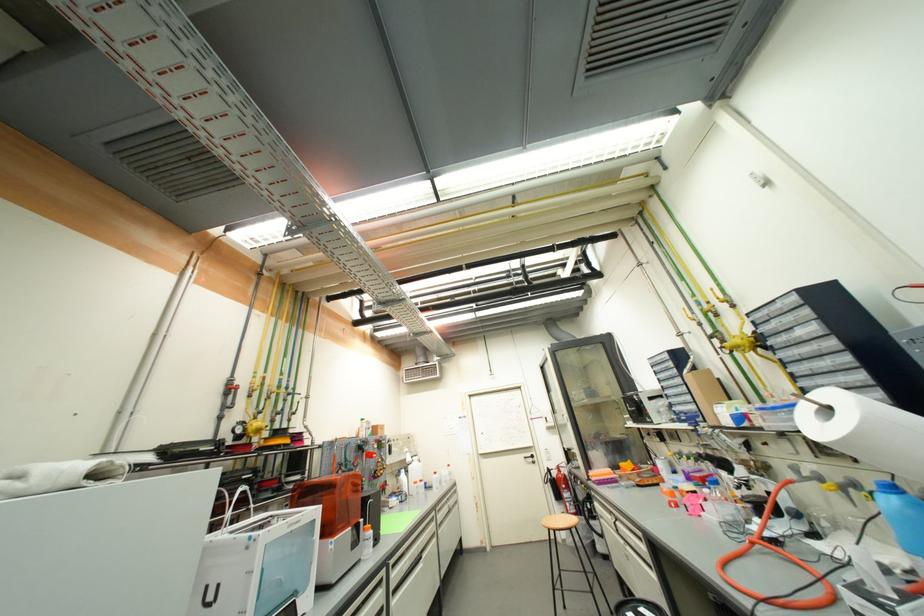
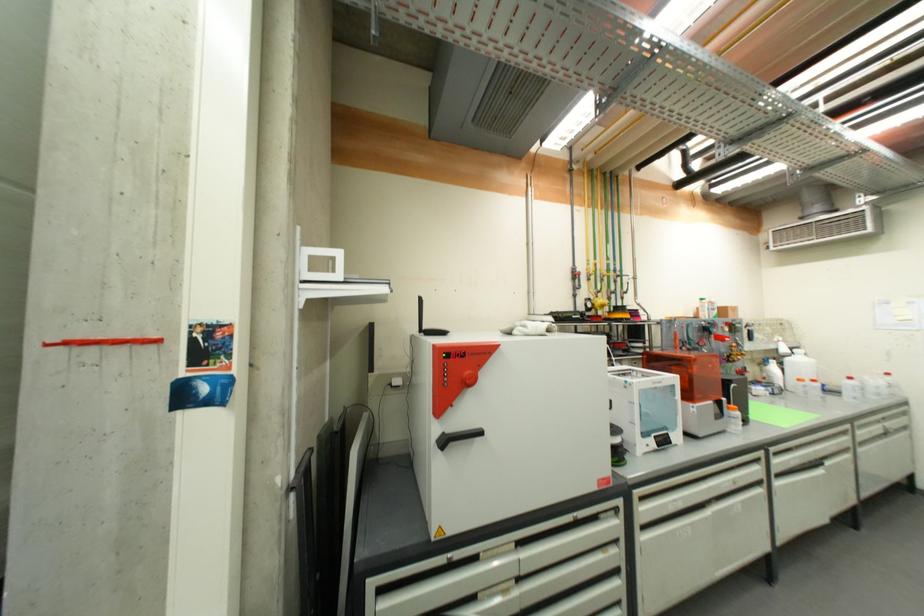
The point at (407,487) is marked in the first image. Where is the corresponding point in the second image?

(774, 378)